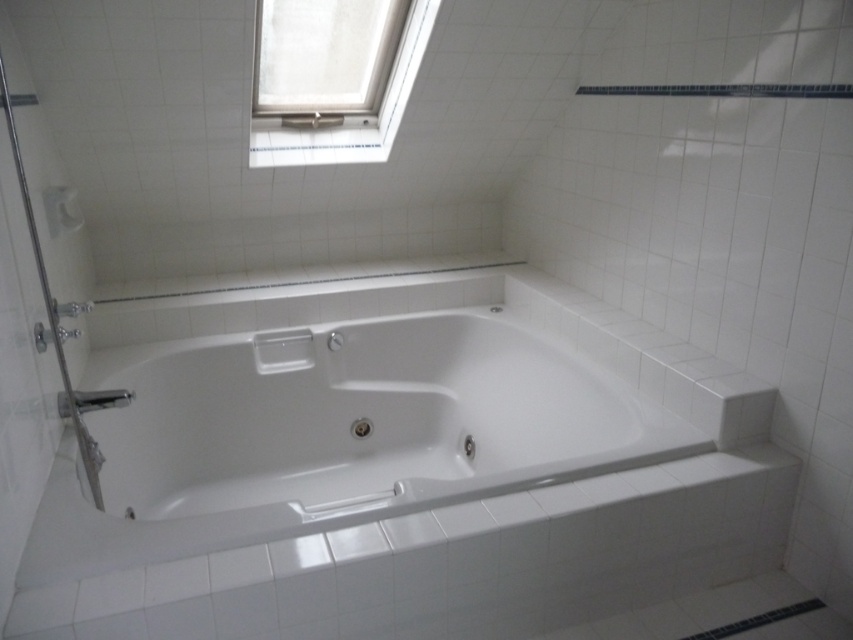
Can you confirm if white glossy bathtub at center is positioned above satin nickel faucet at lower left?

No, white glossy bathtub at center is not above satin nickel faucet at lower left.

Can you confirm if white glossy bathtub at center is taller than satin nickel faucet at lower left?

Correct, white glossy bathtub at center is much taller as satin nickel faucet at lower left.

Find the location of a particular element. The width and height of the screenshot is (853, 640). white glossy bathtub at center is located at coordinates (335, 435).

At what (x,y) coordinates should I click in order to perform the action: click on white glossy bathtub at center. Please return your answer as a coordinate pair (x, y). The image size is (853, 640). Looking at the image, I should click on (335, 435).

Identify the location of white glossy bathtub at center. (335, 435).

Can you confirm if white plastic window at upper center is positioned above satin nickel faucet at lower left?

Correct, white plastic window at upper center is located above satin nickel faucet at lower left.

Is white plastic window at upper center thinner than satin nickel faucet at lower left?

In fact, white plastic window at upper center might be wider than satin nickel faucet at lower left.

Locate an element on the screen. white plastic window at upper center is located at coordinates (360, 125).

Find the location of a particular element. The width and height of the screenshot is (853, 640). white plastic window at upper center is located at coordinates (360, 125).